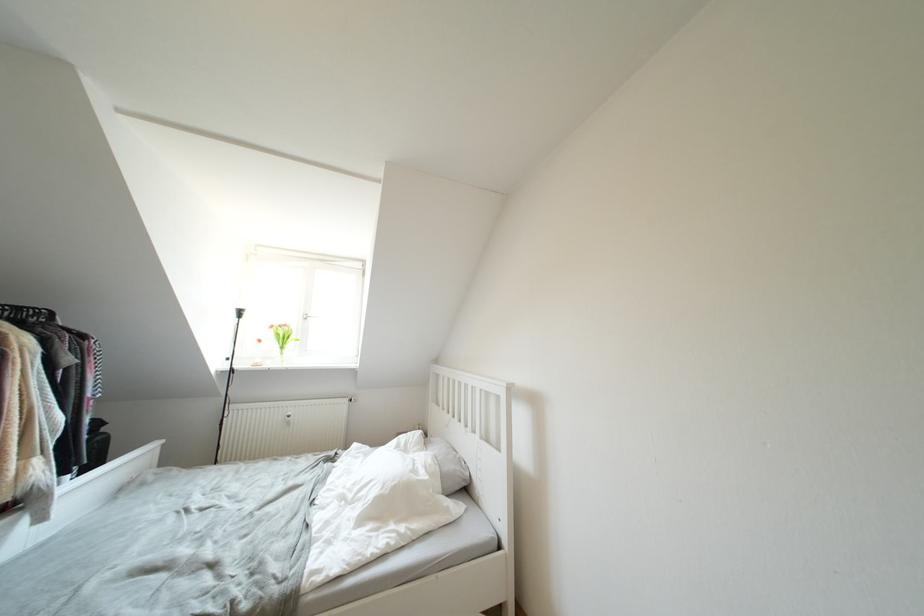
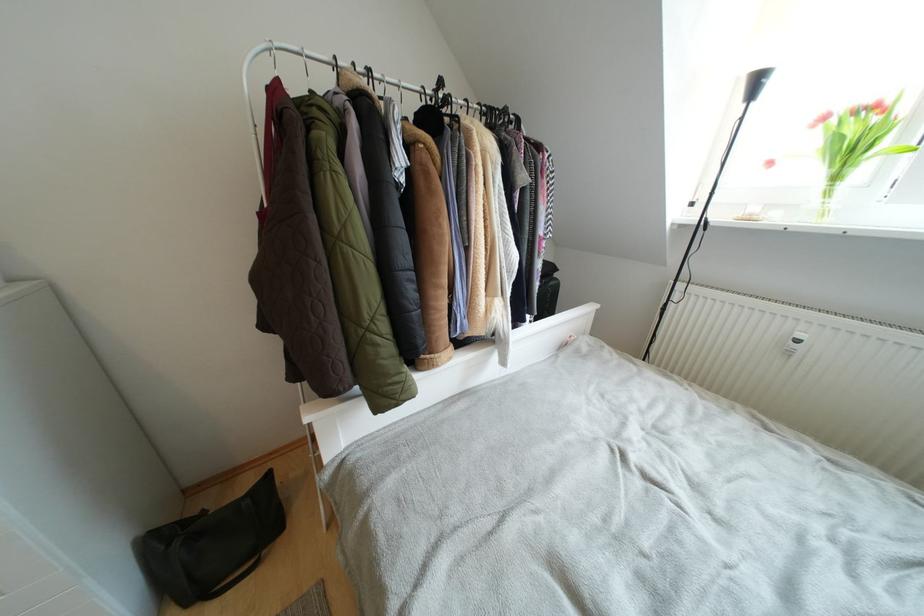
The point at (295, 416) is marked in the first image. Where is the corresponding point in the second image?

(805, 339)